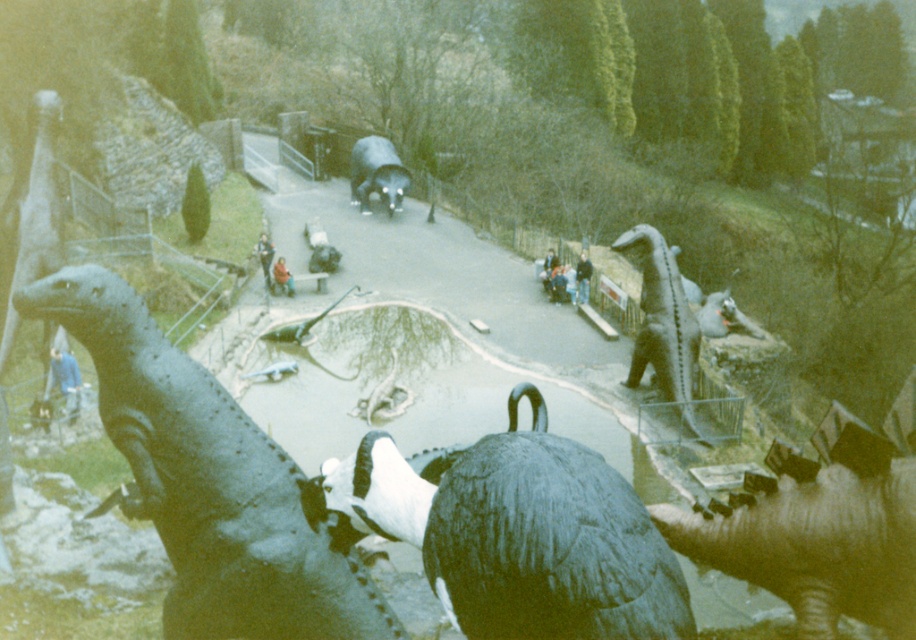
Question: In this image, where is shiny metallic dinosaur at left located relative to blue denim jacket at center?

Choices:
 (A) right
 (B) left

Answer: (B)

Question: Which of these objects is positioned farthest from the shiny metallic dinosaur at center?

Choices:
 (A) shiny metallic tank at center
 (B) blue fabric person at lower left

Answer: (A)

Question: Which of the following is the closest to the observer?

Choices:
 (A) (x=280, y=266)
 (B) (x=897, y=554)
 (C) (x=551, y=259)
 (D) (x=180, y=480)

Answer: (B)

Question: Estimate the real-world distances between objects in this image. Which object is closer to the blue denim jacket at center?

Choices:
 (A) shiny metallic dinosaur at lower right
 (B) light blue denim jacket at center
 (C) shiny metallic dinosaur at center

Answer: (C)

Question: Where is blue fabric person at lower left located in relation to dark blue jeans at center in the image?

Choices:
 (A) left
 (B) right

Answer: (A)

Question: Does shiny metallic dinosaur at left have a greater width compared to blue fabric person at lower left?

Choices:
 (A) yes
 (B) no

Answer: (A)